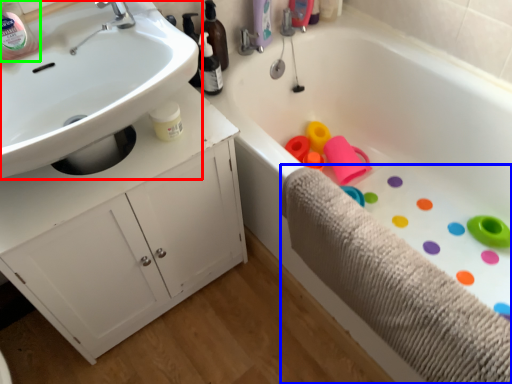
Question: Considering the real-world distances, which object is closest to sink (highlighted by a red box)? bath towel (highlighted by a blue box) or bottle (highlighted by a green box).

Choices:
 (A) bath towel
 (B) bottle

Answer: (B)